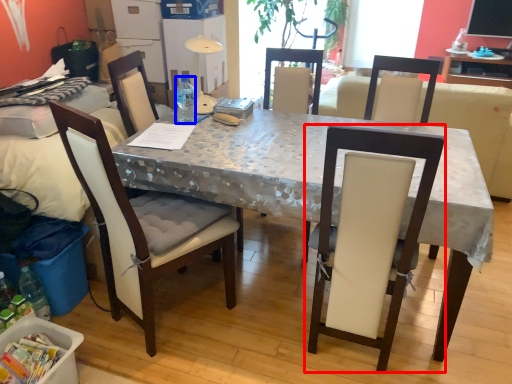
Question: Among these objects, which one is nearest to the camera, chair (highlighted by a red box) or bottle (highlighted by a blue box)?

Choices:
 (A) chair
 (B) bottle

Answer: (A)